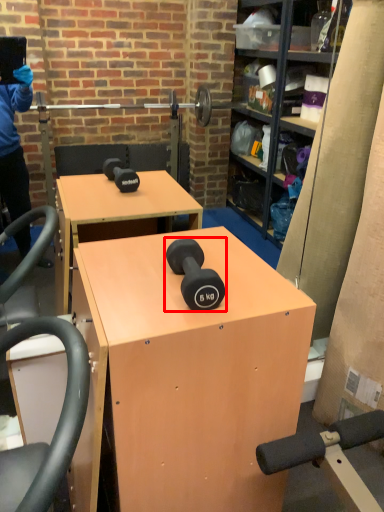
Question: From the image's perspective, what is the correct spatial relationship of dumbbell (annotated by the red box) in relation to desk?

Choices:
 (A) above
 (B) below

Answer: (A)